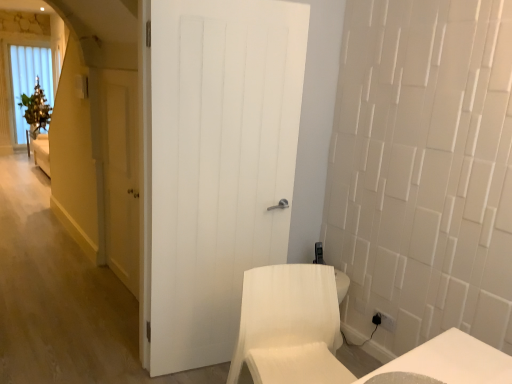
Question: Does yellow matte door at left, the 2th door in the front-to-back sequence, lie in front of white wooden door at center, the 2th door when ordered from left to right?

Choices:
 (A) yes
 (B) no

Answer: (B)

Question: Is yellow matte door at left, the 2th door in the right-to-left sequence, bigger than white wooden door at center, the second door when ordered from back to front?

Choices:
 (A) no
 (B) yes

Answer: (A)

Question: Is yellow matte door at left, arranged as the 1th door when viewed from the left, wider than white wooden door at center, marked as the first door in a front-to-back arrangement?

Choices:
 (A) no
 (B) yes

Answer: (A)

Question: Does yellow matte door at left, the 2th door in the right-to-left sequence, have a lesser width compared to white wooden door at center, which ranks as the 1th door in right-to-left order?

Choices:
 (A) yes
 (B) no

Answer: (A)

Question: Is yellow matte door at left, positioned as the 1th door in back-to-front order, positioned far away from white wooden door at center, marked as the first door in a front-to-back arrangement?

Choices:
 (A) yes
 (B) no

Answer: (B)

Question: From a real-world perspective, is yellow matte door at left, the 2th door in the right-to-left sequence, under white wooden door at center, marked as the first door in a front-to-back arrangement?

Choices:
 (A) no
 (B) yes

Answer: (B)

Question: From a real-world perspective, is white fabric chair at lower right physically above white wooden door at center, the second door when ordered from back to front?

Choices:
 (A) no
 (B) yes

Answer: (A)

Question: Are white fabric chair at lower right and white wooden door at center, the 2th door when ordered from left to right, making contact?

Choices:
 (A) no
 (B) yes

Answer: (A)

Question: Is white fabric chair at lower right shorter than white wooden door at center, the second door when ordered from back to front?

Choices:
 (A) no
 (B) yes

Answer: (B)

Question: From the image's perspective, would you say white fabric chair at lower right is shown under white wooden door at center, which ranks as the 1th door in right-to-left order?

Choices:
 (A) no
 (B) yes

Answer: (B)

Question: From a real-world perspective, does white fabric chair at lower right sit lower than white wooden door at center, the 2th door when ordered from left to right?

Choices:
 (A) yes
 (B) no

Answer: (A)

Question: Does white fabric chair at lower right have a greater width compared to white wooden door at center, which ranks as the 1th door in right-to-left order?

Choices:
 (A) no
 (B) yes

Answer: (B)

Question: Can you confirm if yellow matte door at left, the 2th door in the front-to-back sequence, is taller than white fabric chair at lower right?

Choices:
 (A) no
 (B) yes

Answer: (B)